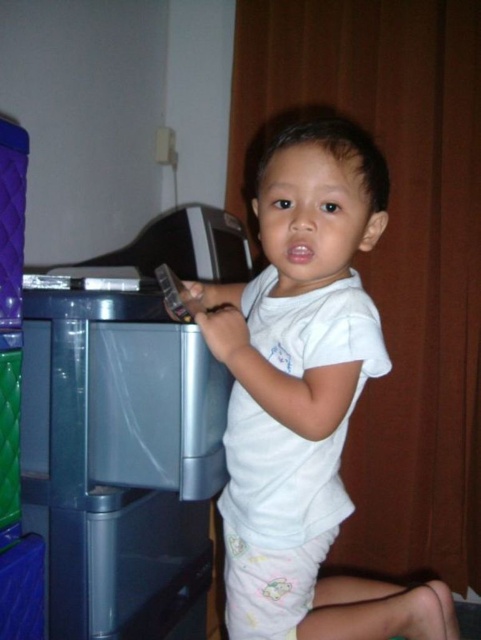
Question: Can you confirm if white cotton shirt at center is wider than transparent plastic atm at left?

Choices:
 (A) yes
 (B) no

Answer: (A)

Question: Which point is farther from the camera taking this photo?

Choices:
 (A) (198, 362)
 (B) (303, 140)

Answer: (A)

Question: Observing the image, what is the correct spatial positioning of white cotton shirt at center in reference to transparent plastic atm at left?

Choices:
 (A) right
 (B) left

Answer: (A)

Question: Is white cotton shirt at center positioned at the back of transparent plastic atm at left?

Choices:
 (A) yes
 (B) no

Answer: (B)

Question: Which object is closer to the camera taking this photo?

Choices:
 (A) transparent plastic atm at left
 (B) white cotton shirt at center

Answer: (B)